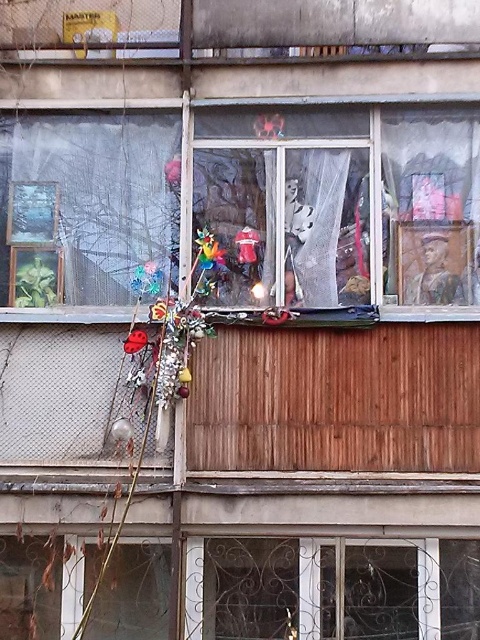
Between point (336, 131) and point (238, 248), which one is positioned behind?

Point (238, 248)

Who is positioned more to the left, transparent plastic window at center or shiny red toy at center?

From the viewer's perspective, transparent plastic window at center appears more on the left side.

The image size is (480, 640). I want to click on transparent plastic window at center, so tap(264, 204).

The image size is (480, 640). Identify the location of transparent plastic window at center. (264, 204).

Is transparent plastic window at upper left positioned at the back of shiny red toy at center?

No, transparent plastic window at upper left is in front of shiny red toy at center.

Which is in front, point (8, 236) or point (244, 250)?

Point (244, 250) is more forward.

This screenshot has width=480, height=640. What are the coordinates of `transparent plastic window at upper left` in the screenshot? It's located at (86, 205).

Between transparent plastic window at center and transparent plastic window at upper left, which one has more height?

transparent plastic window at center

The height and width of the screenshot is (640, 480). What do you see at coordinates (264, 204) in the screenshot?
I see `transparent plastic window at center` at bounding box center [264, 204].

The image size is (480, 640). I want to click on transparent plastic window at center, so click(264, 204).